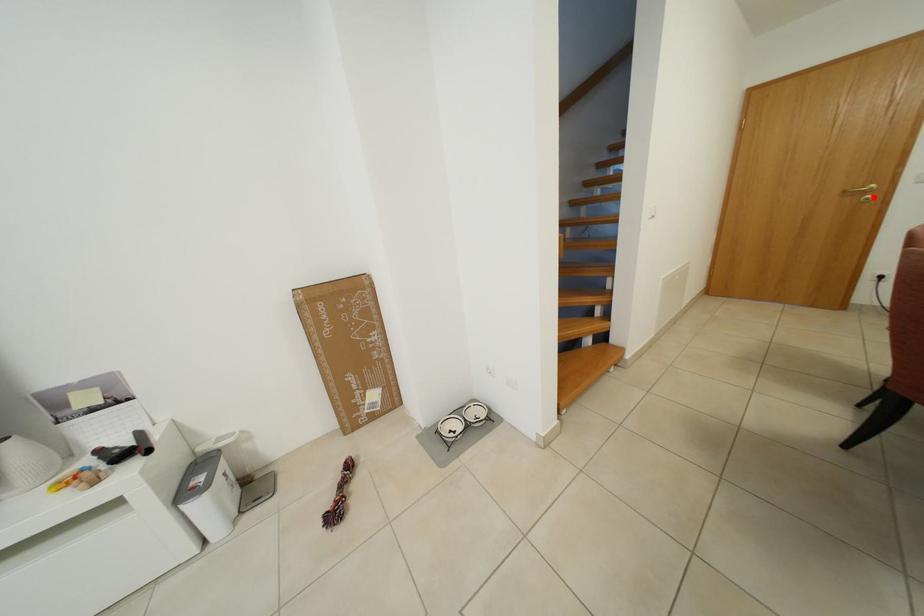
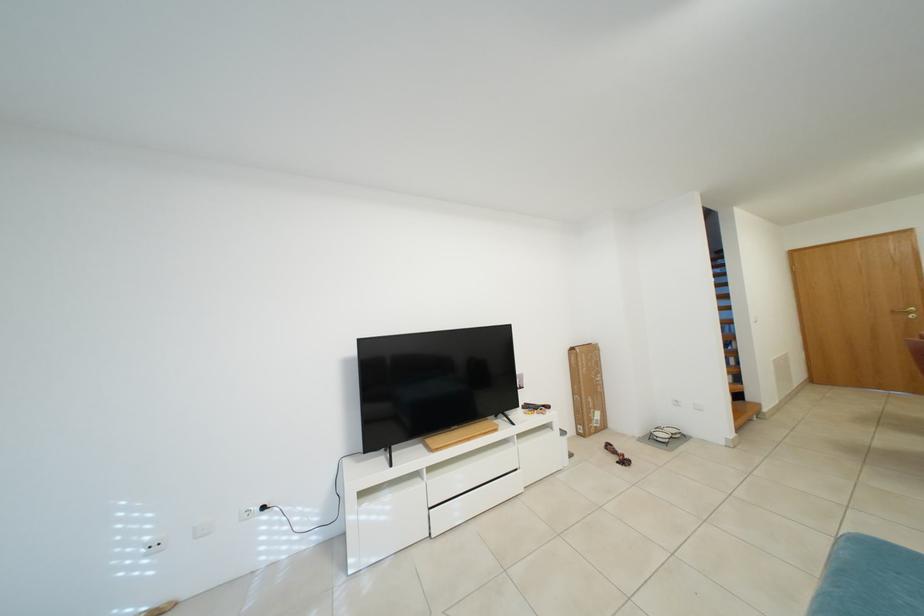
Question: I am providing you with two images of the same scene from different viewpoints. A red point is shown in image1. For the corresponding object point in image2, is it positioned nearer or farther from the camera?

Choices:
 (A) Nearer
 (B) Farther

Answer: (A)